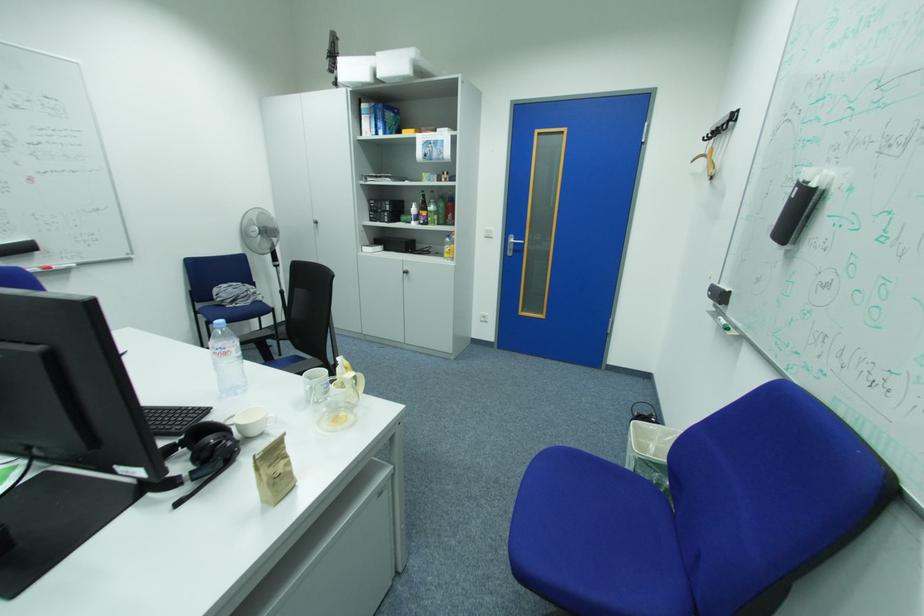
Identify the location of white storage box. The width and height of the screenshot is (924, 616). (335, 556).